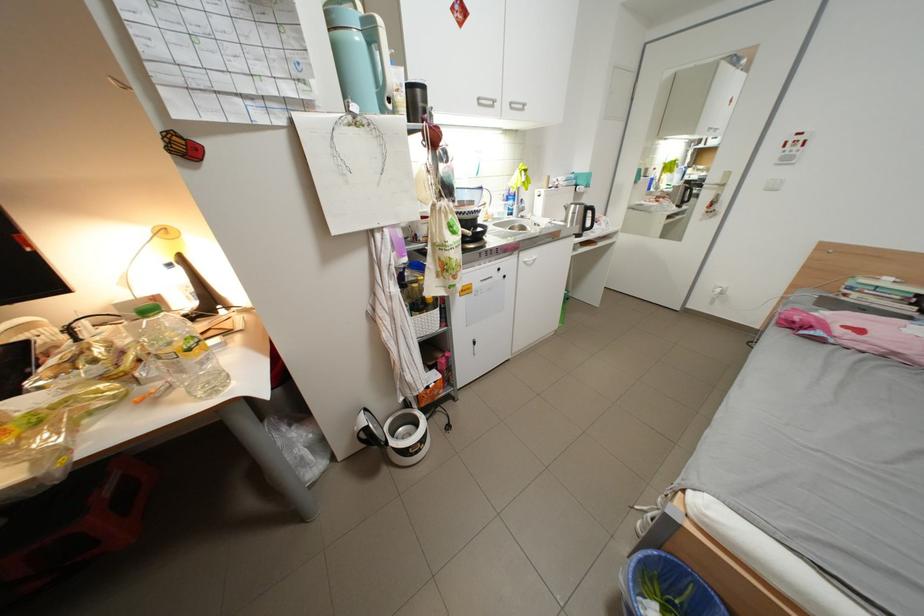
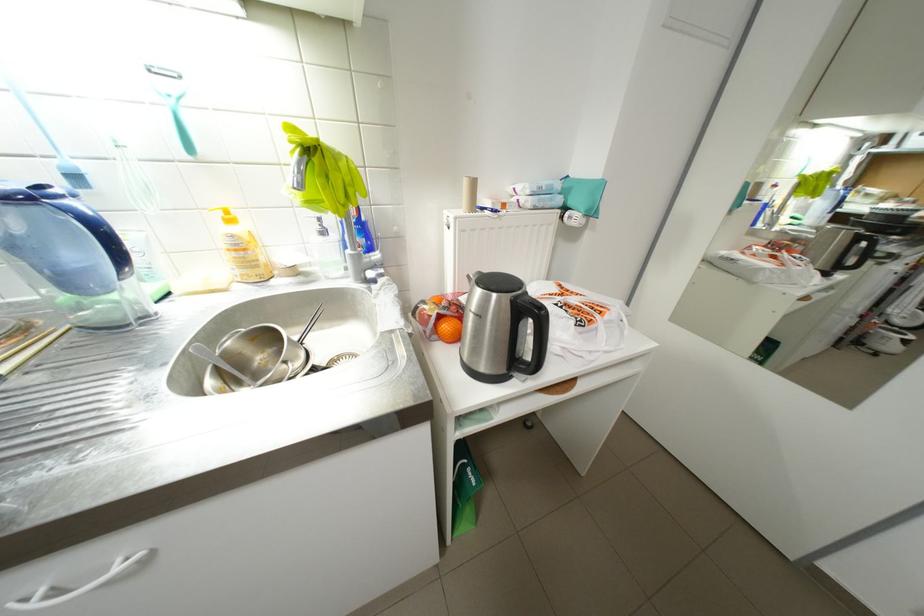
In a continuous first-person perspective shot, in which direction is the camera moving?

The movement direction of the cameraman is right, forward.